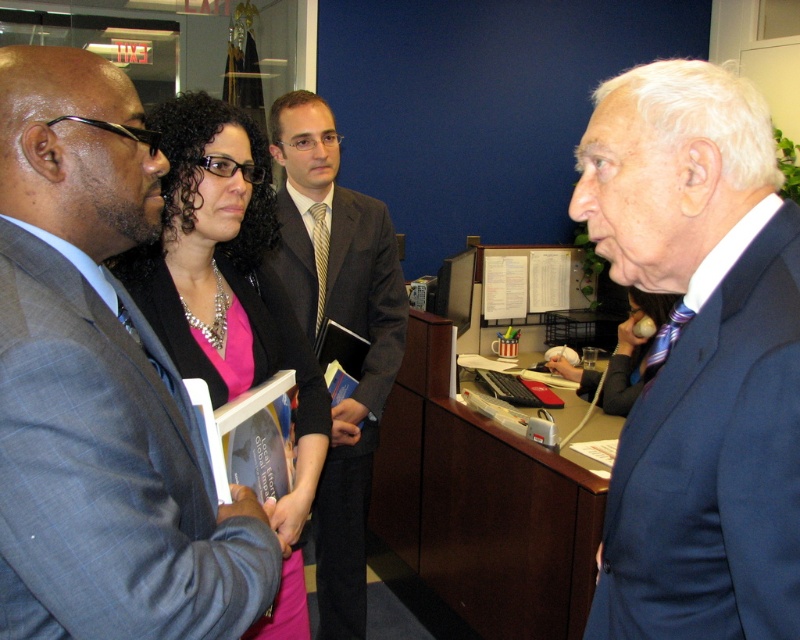
You are organizing a photo shoot and need to arrange two suits for a promotional image. The matte gray suit at center and the blue suit at right are available. If you want the wider suit to be placed on the left side of the image, which suit should you choose?

The matte gray suit at center is wider than the blue suit at right, so you should choose the matte gray suit at center to place on the left side of the image for the promotional shoot.

Based on the scene description, which object is shorter in height between the pink satin blouse at center and the dark gray suit at center?

The pink satin blouse at center is shorter in height than the dark gray suit at center according to the description.

Consider the image. You are a tailor who needs to determine which suit requires more fabric for alterations. Based on the image, which suit between the matte gray suit at center and the blue suit at right would need more fabric due to its size?

The matte gray suit at center requires more fabric for alterations because it is bigger than the blue suit at right.